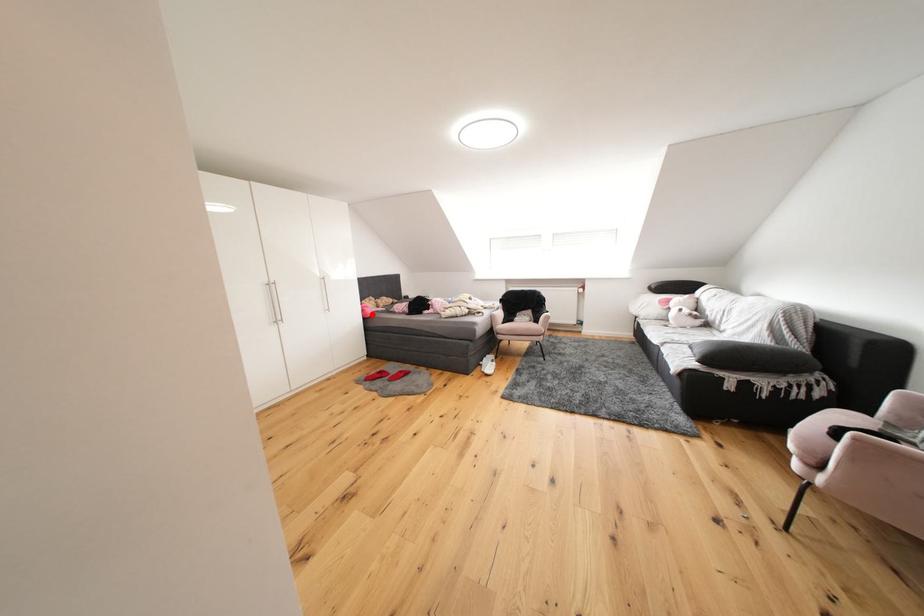
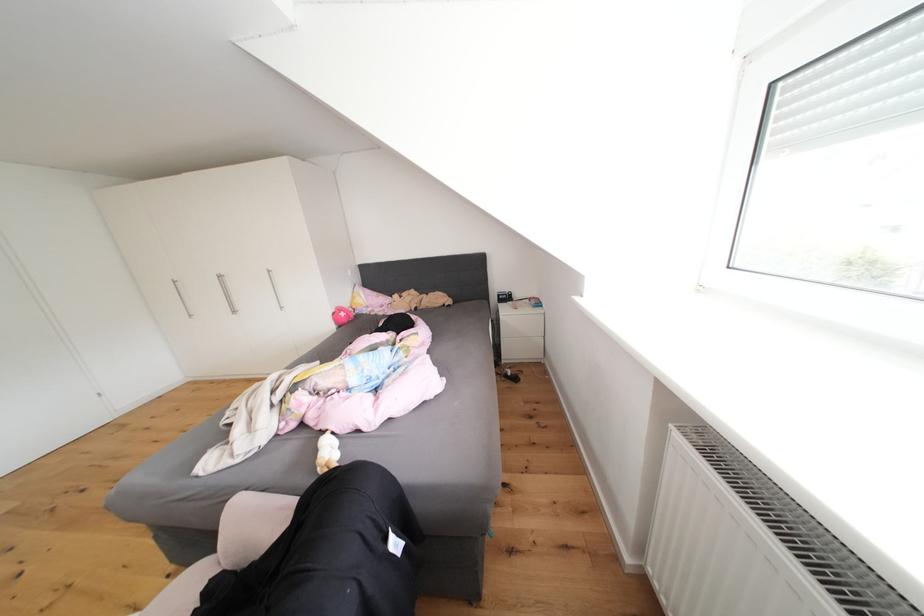
Find the pixel in the second image that matches the highlighted location in the first image.

(343, 318)